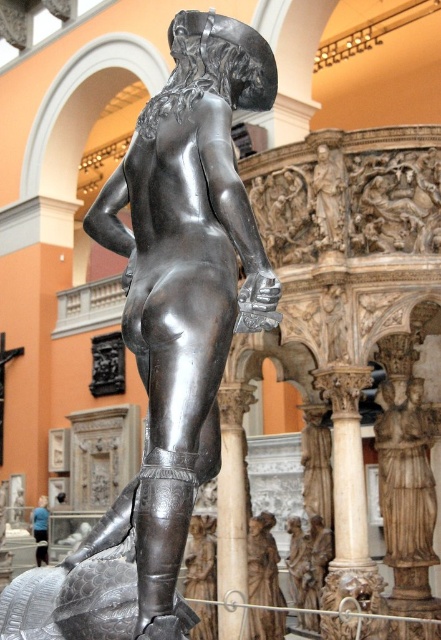
You are a photographer standing in front of the bronze sculpture. You want to take a photo that captures both the point at coordinates point (343, 483) and point (221, 532). Which point is closer to your camera lens?

Point (343, 483) is closer to the camera than point (221, 532), so it will appear closer in the photo.

You are an art conservator examining the bronze sculpture. You notice two points on the sculpture marked at coordinates point (220, 541) and point (37, 515). Which of these points is nearer to your current viewpoint?

Point (220, 541) is closer to the viewer than point (37, 515).

You are an art student observing the bronze sculpture in the museum. You notice two structures behind it. Which one is positioned lower between the white marble column at center and the smooth marble pillar at center?

The white marble column at center is positioned lower than the smooth marble pillar at center.